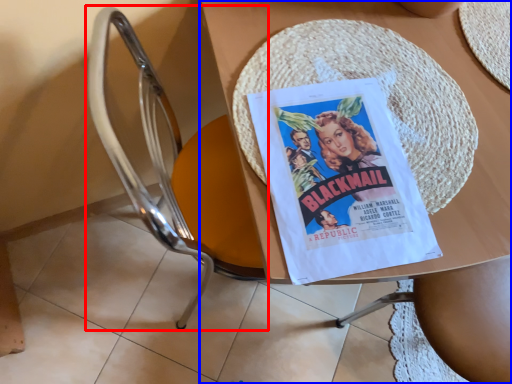
Question: Which object is closer to the camera taking this photo, chair (highlighted by a red box) or table (highlighted by a blue box)?

Choices:
 (A) chair
 (B) table

Answer: (A)